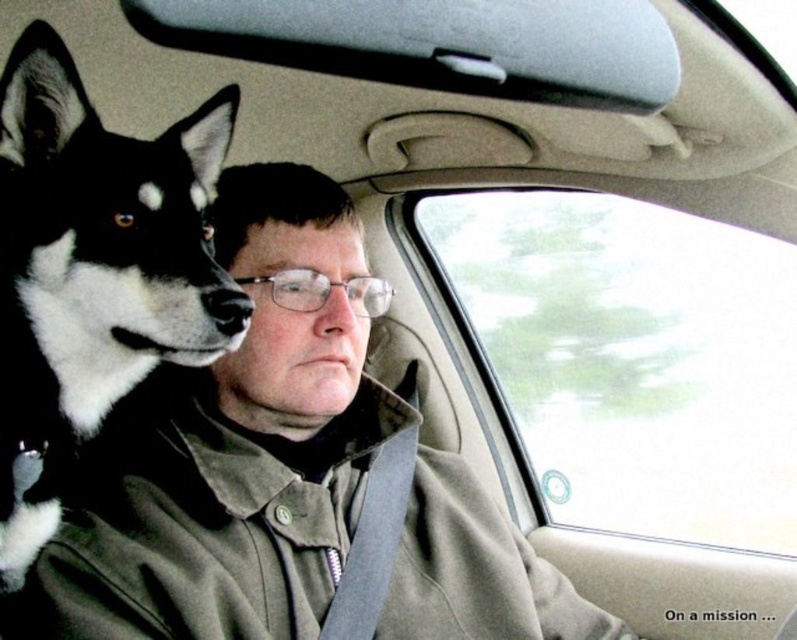
Question: Where is brown textured fabric trench coat at center located in relation to black fur dog at left in the image?

Choices:
 (A) left
 (B) right

Answer: (B)

Question: Among these objects, which one is farthest from the camera?

Choices:
 (A) brown textured fabric trench coat at center
 (B) transparent glass window at center

Answer: (B)

Question: Can you confirm if transparent glass window at center is positioned above black fur dog at left?

Choices:
 (A) yes
 (B) no

Answer: (B)

Question: Which of the following is the closest to the observer?

Choices:
 (A) black fur dog at left
 (B) brown textured fabric trench coat at center
 (C) transparent glass window at center

Answer: (A)

Question: Which point is farther from the camera taking this photo?

Choices:
 (A) (470, 273)
 (B) (442, 465)
 (C) (130, 337)

Answer: (A)

Question: Can you confirm if brown textured fabric trench coat at center is positioned below black fur dog at left?

Choices:
 (A) no
 (B) yes

Answer: (B)